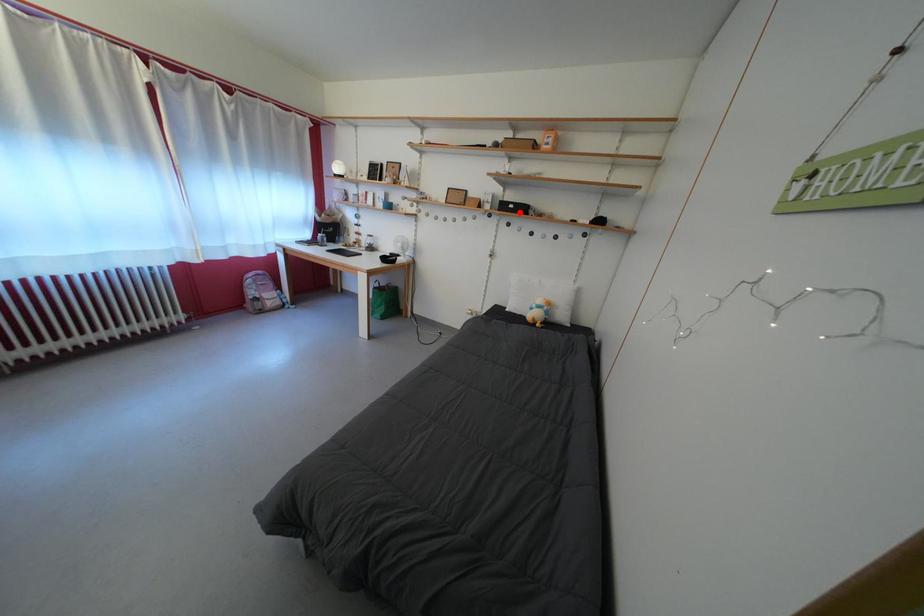
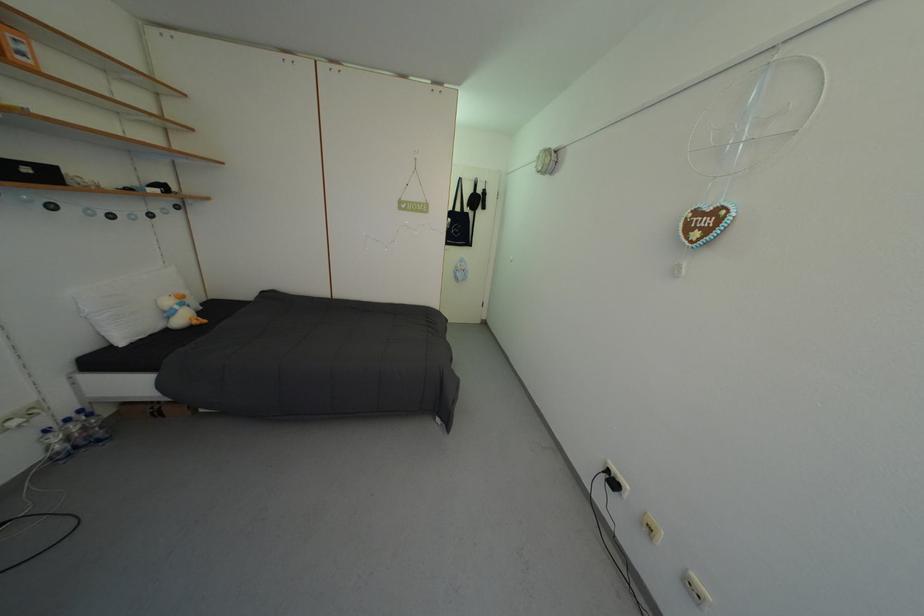
Question: I am providing you with two images of the same scene from different viewpoints. Image1 has a red point marked. In image2, the corresponding 3D location appears at what relative position? Reply with the corresponding letter.

Choices:
 (A) Closer
 (B) Farther

Answer: (B)